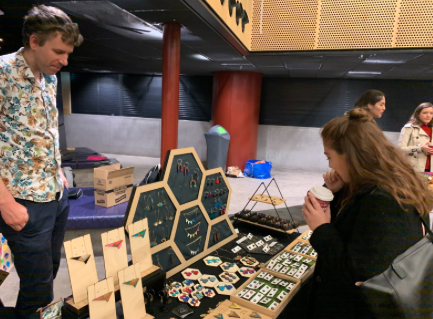
Find the location of a particular element. This screenshot has height=319, width=433. reflection of the light on the ceiling is located at coordinates (150, 31).